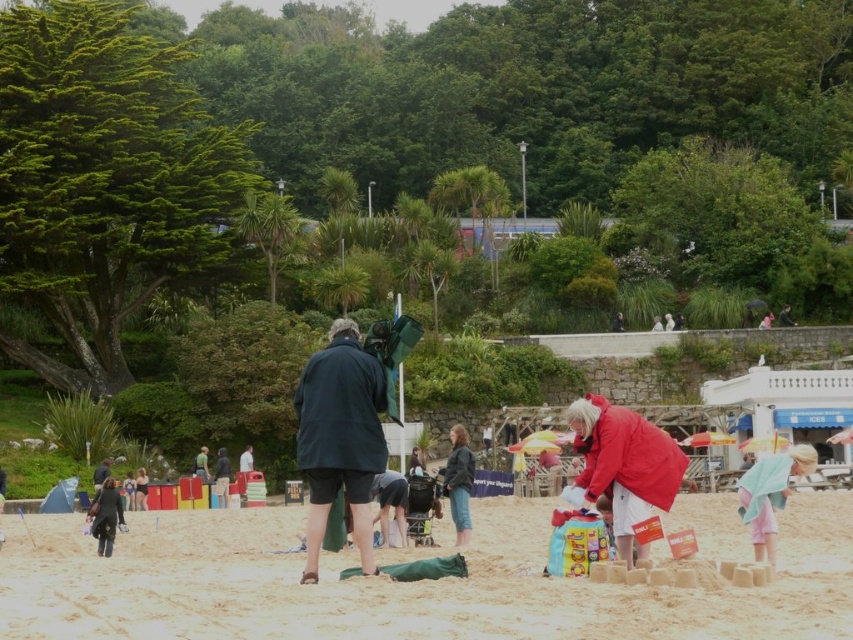
Question: Can you confirm if red matte jacket at center is wider than leather jacket at center?

Choices:
 (A) yes
 (B) no

Answer: (A)

Question: Is pink cotton towel at lower right below leather jacket at center?

Choices:
 (A) no
 (B) yes

Answer: (A)

Question: Which point appears closest to the camera in this image?

Choices:
 (A) (770, 564)
 (B) (622, 408)
 (C) (364, 374)
 (D) (120, 515)

Answer: (A)

Question: Which of the following is the farthest from the observer?

Choices:
 (A) pink cotton towel at lower right
 (B) beige sandcastle at center

Answer: (A)

Question: Is red matte jacket at center to the right of leather jacket at center from the viewer's perspective?

Choices:
 (A) yes
 (B) no

Answer: (A)

Question: Which is nearer to the leather jacket at center?

Choices:
 (A) dark gray fabric bag at lower left
 (B) pink cotton towel at lower right

Answer: (B)